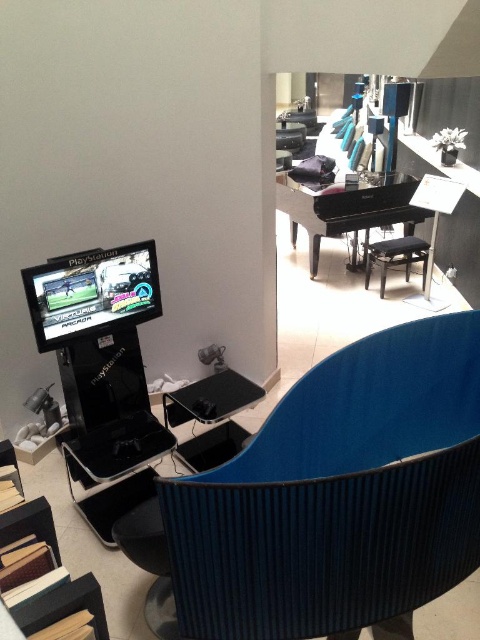
You are planning to place a new gaming console that requires a space of 1.2 meters in width. You see the shiny black arcade machine at left and the black leather stool at center in the room. Which object occupies more space in terms of width?

The black leather stool at center occupies more space in terms of width than the shiny black arcade machine at left since the shiny black arcade machine at left has a smaller size compared to black leather stool at center.

Consider the image. You are standing in the middle of the showroom and want to sit down. Which object should you approach to reach the blue fabric swivel chair at lower right?

The blue fabric swivel chair at lower right is located at coordinates (338, 493), so you should approach that point to reach it.

You are a customer in a furniture store and want to sit on the blue fabric swivel chair at lower right and the black leather stool at center. Which one is closer to you if you are standing in front of the PlayStation arcade setup on the left?

The blue fabric swivel chair at lower right is closer to you since it is in front of the black leather stool at center, placing it nearer to your position in front of the PlayStation arcade setup.